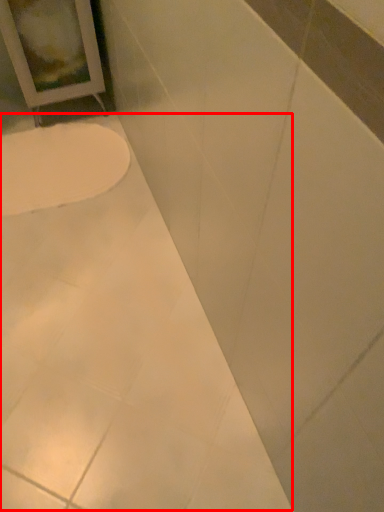
Question: From the image's perspective, what is the correct spatial relationship of bath (annotated by the red box) in relation to toilet?

Choices:
 (A) below
 (B) above

Answer: (A)